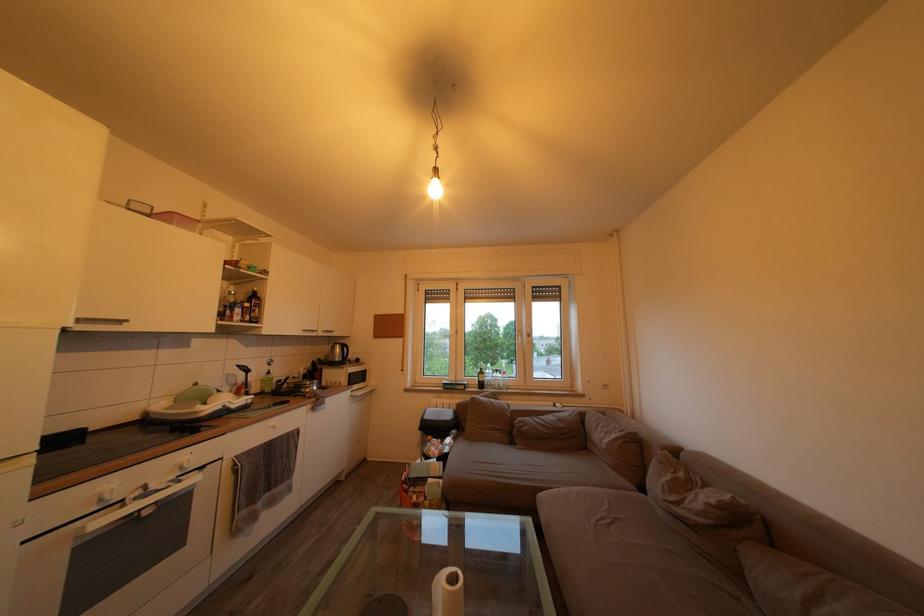
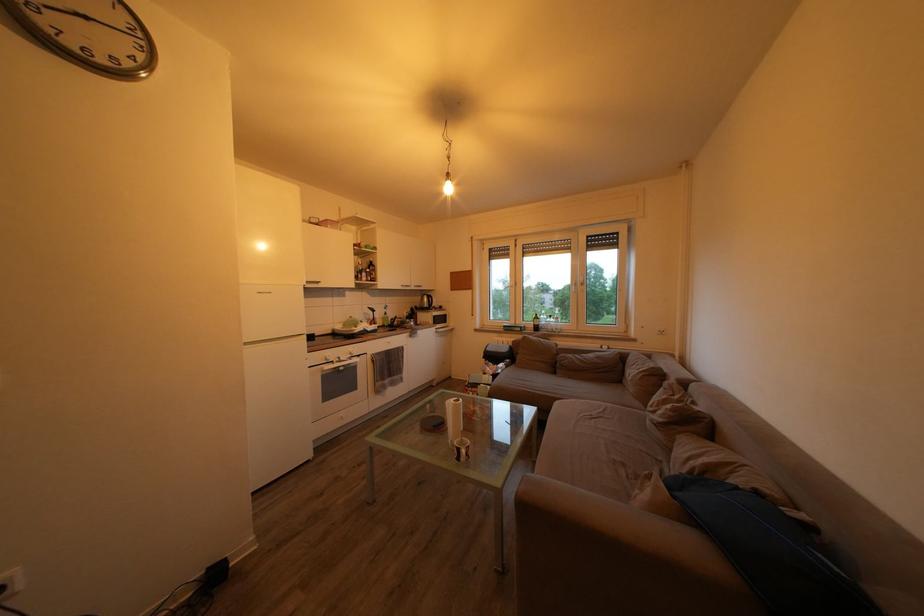
The point at (x=169, y=411) is marked in the first image. Where is the corresponding point in the second image?

(346, 333)